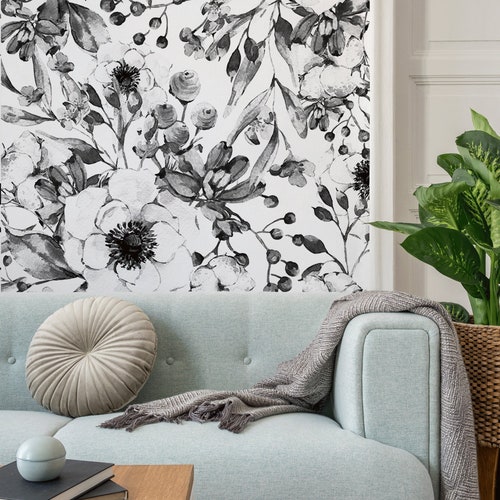
This screenshot has height=500, width=500. I want to click on round blue dish, so click(x=31, y=458).